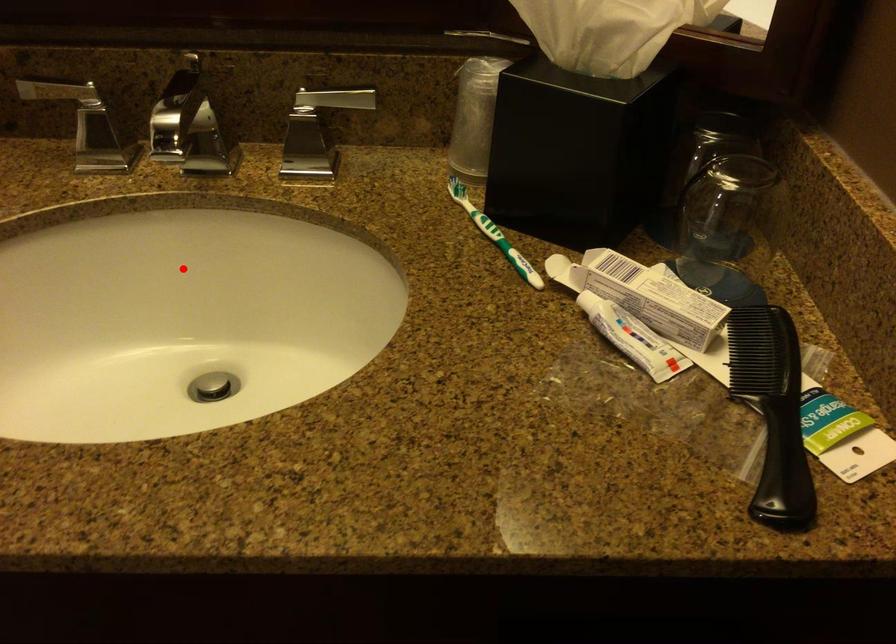
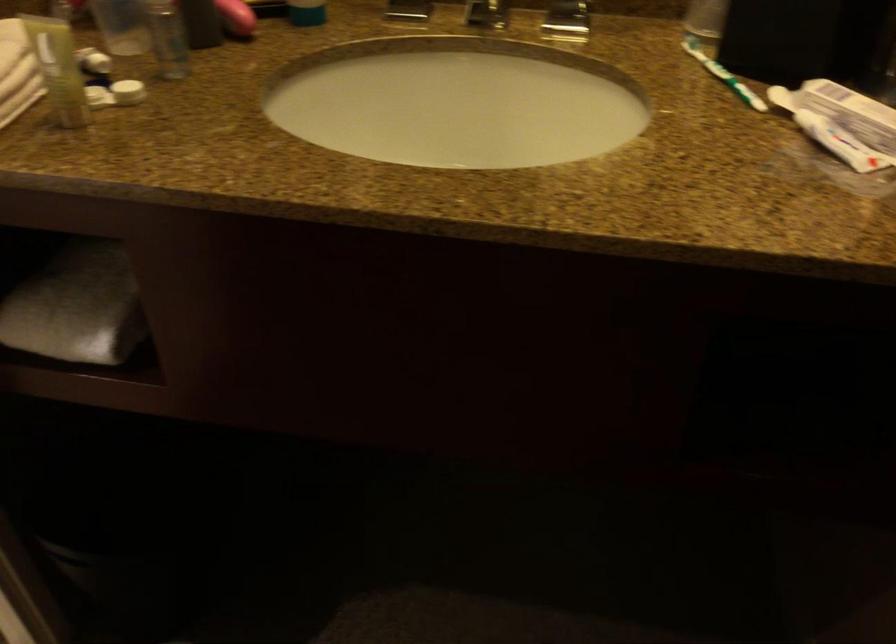
The point at the highlighted location is marked in the first image. Where is the corresponding point in the second image?

(457, 102)